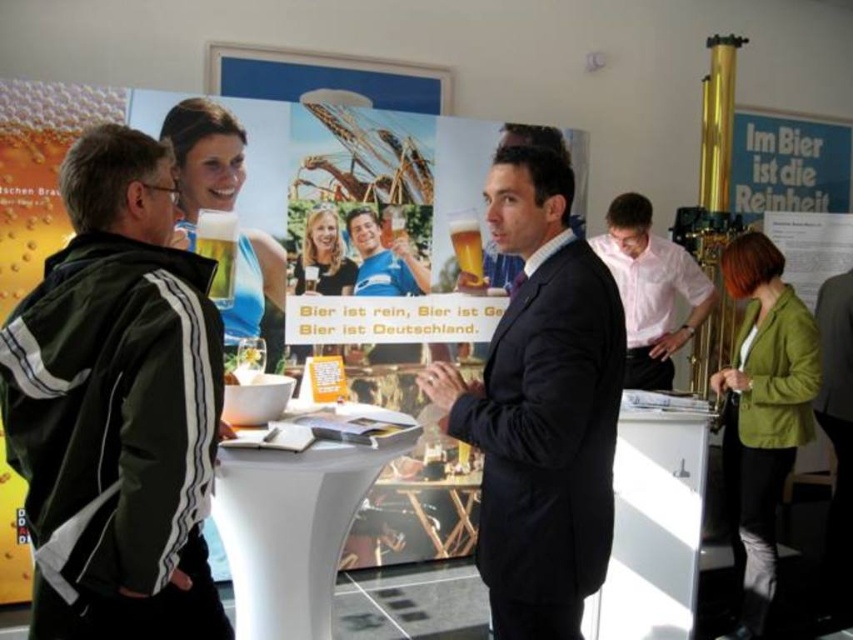
Does green cotton jacket at lower right have a smaller size compared to matte black jacket at center?

No, green cotton jacket at lower right is not smaller than matte black jacket at center.

Which is behind, point (761, 232) or point (320, 216)?

Point (761, 232)

Is point (752, 563) positioned before point (320, 257)?

Yes, point (752, 563) is in front of point (320, 257).

Where is `green cotton jacket at lower right`? green cotton jacket at lower right is located at coordinates (762, 412).

In the scene shown: Is the position of matte blue dress at center less distant than that of dark gray suit at center?

Yes, it is.

Can you confirm if matte blue dress at center is thinner than dark gray suit at center?

Indeed, matte blue dress at center has a lesser width compared to dark gray suit at center.

Between point (183, 104) and point (836, 576), which one is positioned behind?

The point (836, 576) is behind.

Where is `matte blue dress at center`? This screenshot has height=640, width=853. matte blue dress at center is located at coordinates (204, 157).

Is dark suit at center to the right of green cotton jacket at lower right from the viewer's perspective?

No, dark suit at center is not to the right of green cotton jacket at lower right.

Is point (519, 426) farther from viewer compared to point (749, 547)?

No, (519, 426) is closer to viewer.

The image size is (853, 640). Find the location of `dark suit at center`. dark suit at center is located at coordinates (541, 406).